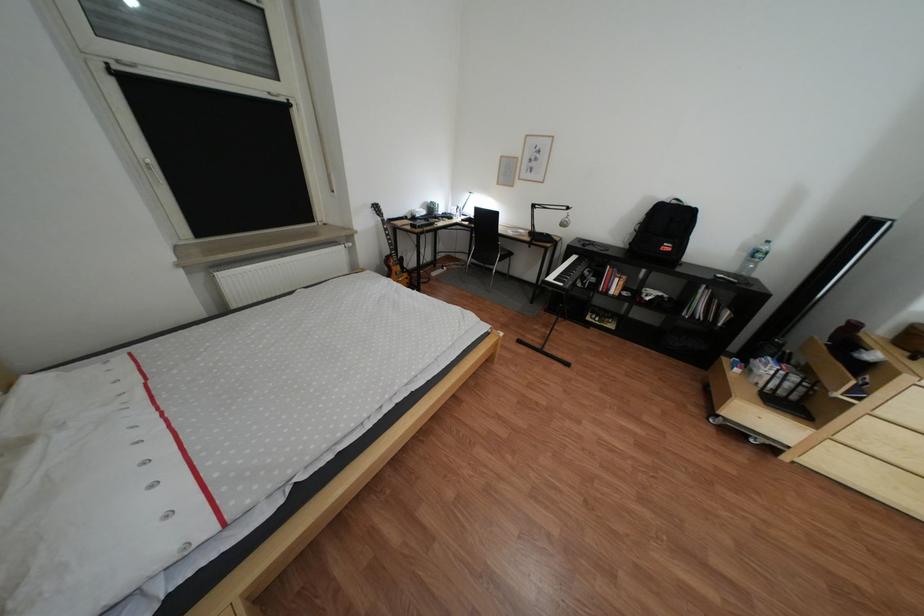
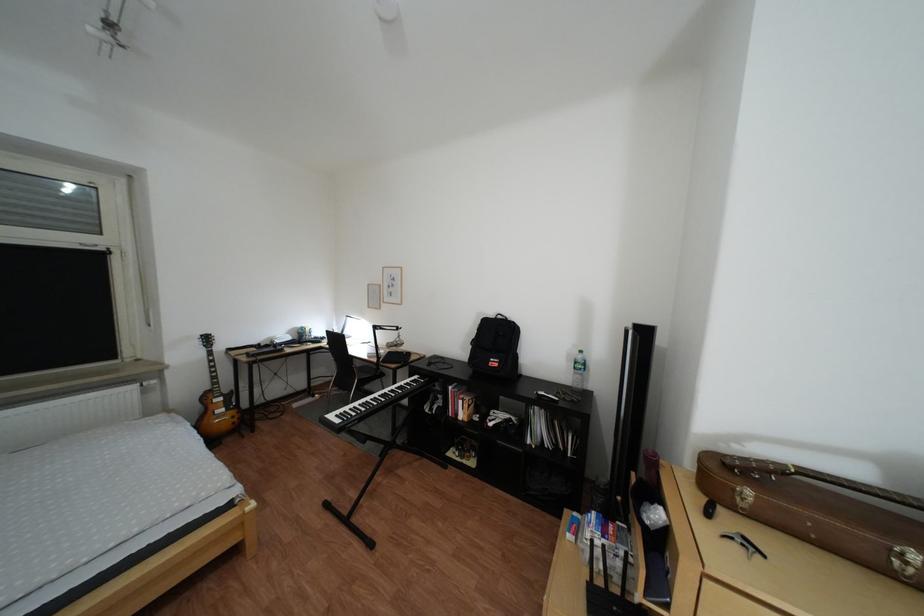
Find the pixel in the second image that matches (x=683, y=248) in the first image.

(509, 363)